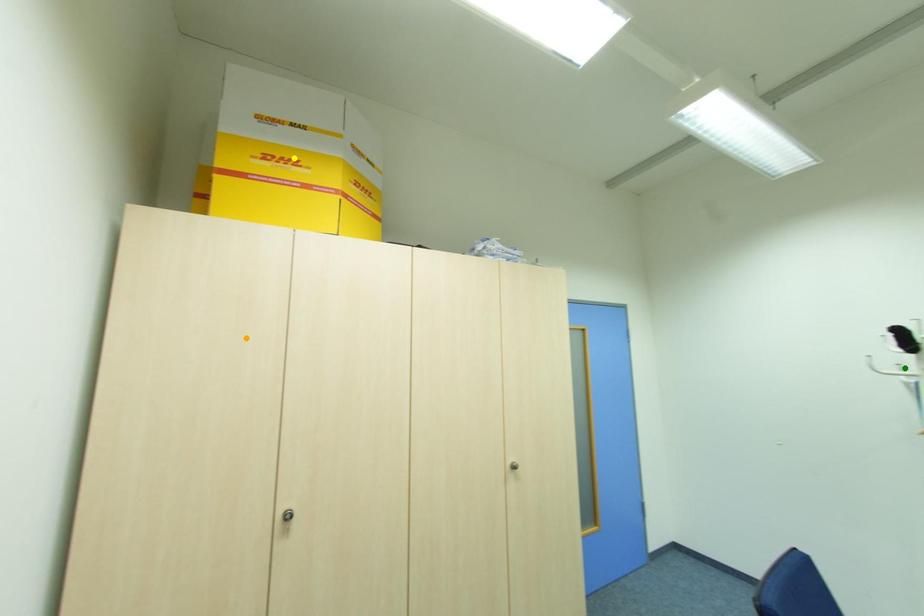
Order these from nearest to farthest:
1. yellow point
2. green point
3. orange point

1. yellow point
2. green point
3. orange point